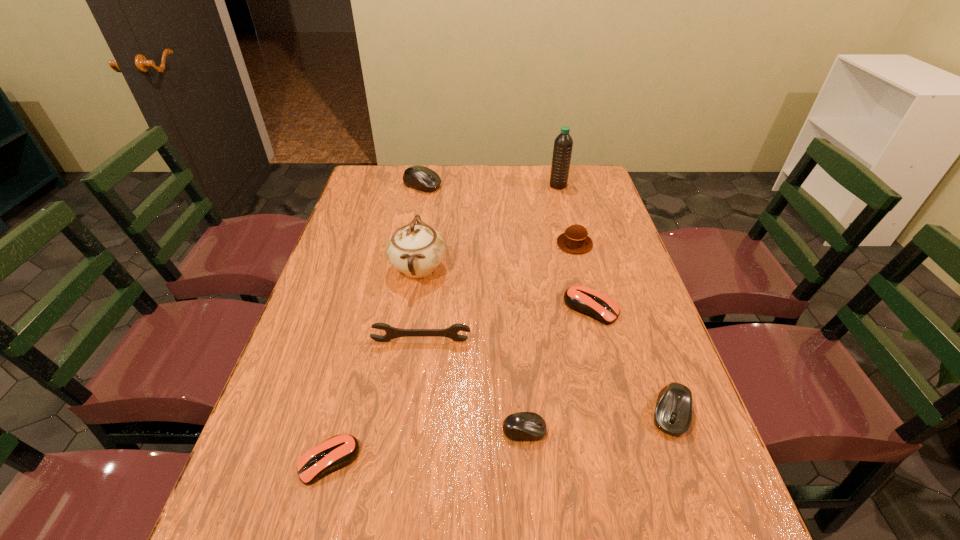
Locate an element on the screen. The height and width of the screenshot is (540, 960). the tallest object is located at coordinates point(563,144).

Locate an element on the screen. The image size is (960, 540). black water bottle is located at coordinates (563, 144).

Where is `the second tallest object`? The height and width of the screenshot is (540, 960). the second tallest object is located at coordinates (416, 250).

At what (x,y) coordinates should I click in order to perform the action: click on white chinaware. Please return your answer as a coordinate pair (x, y). This screenshot has width=960, height=540. Looking at the image, I should click on (416, 250).

Image resolution: width=960 pixels, height=540 pixels. Identify the location of the leftmost black mouse. (421, 178).

Locate an element on the screen. The height and width of the screenshot is (540, 960). the farthest computer mouse is located at coordinates (421, 178).

Where is `muffin`? The width and height of the screenshot is (960, 540). muffin is located at coordinates (575, 240).

The width and height of the screenshot is (960, 540). What are the coordinates of `the sixth farthest object` in the screenshot? It's located at (391, 332).

The height and width of the screenshot is (540, 960). In order to click on the fifth shortest object in this screenshot , I will do pyautogui.click(x=673, y=413).

The height and width of the screenshot is (540, 960). Identify the location of the rightmost black mouse. (673, 413).